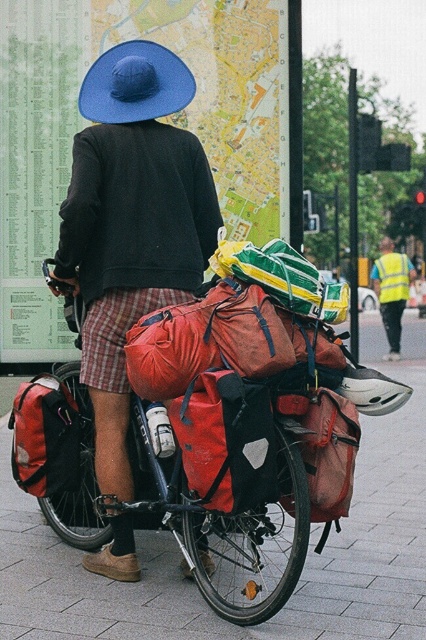
You are a photographer trying to capture both the matte black jacket at center and the blue fabric hat at upper center in a single frame. Since the camera has a limited focus range, which object should you prioritize focusing on to ensure it appears sharp given its size?

The matte black jacket at center is bigger than the blue fabric hat at upper center, so you should prioritize focusing on the matte black jacket at center to ensure it appears sharp.

You are a photographer trying to capture the person and their bicycle in the scene. Since the red fabric bag at center and the blue fabric hat at upper center are both in the frame, which one is closer to the camera?

The red fabric bag at center is closer to the camera because it is in front of the blue fabric hat at upper center.